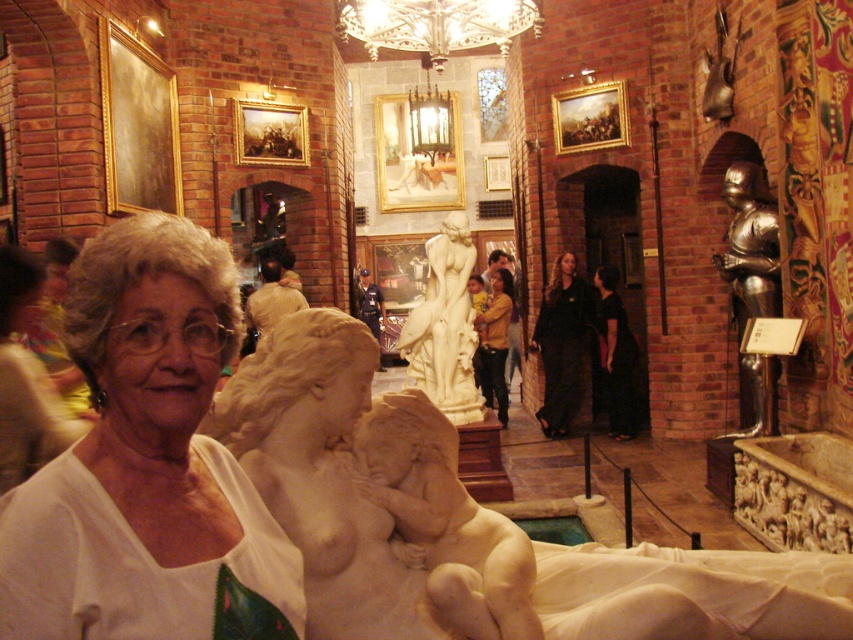
Consider the image. You are an art conservator who needs to move the white marble statue at center and the shiny bronze helmet at upper right to a storage room. The doorway to the storage room is 1 meter wide. Can both items fit through the doorway side by side? Please explain your reasoning.

The white marble statue at center might be wider than the shiny bronze helmet at upper right. Since the doorway is 1 meter wide, if the combined width of both items exceeds 1 meter, they cannot fit side by side. However, without exact measurements, it is uncertain. The conservator should measure both items to determine if their total width is within the doorway limit.